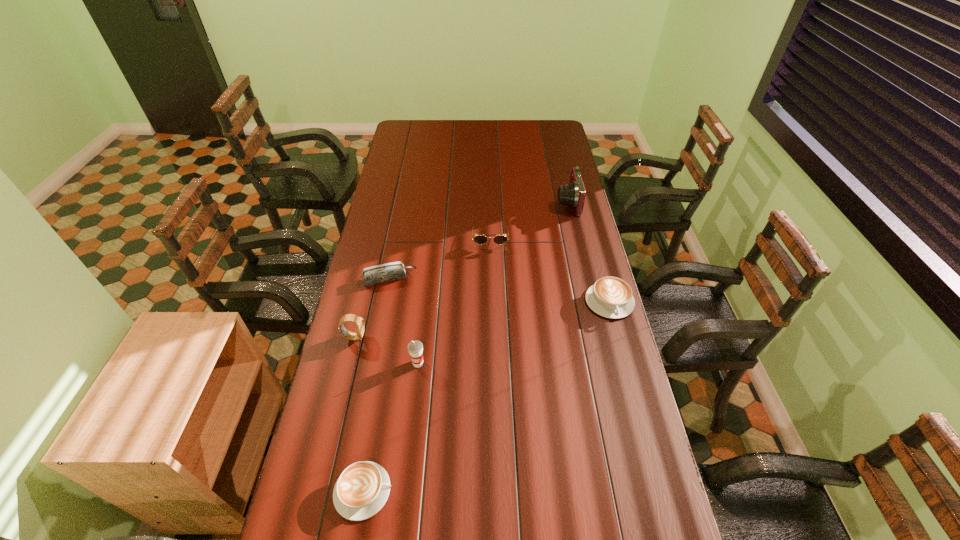
Where is `the fourth object from left to right`? the fourth object from left to right is located at coordinates (415, 347).

Find the location of a particular element. This screenshot has height=540, width=960. cup is located at coordinates (415, 347).

You are a GUI agent. You are given a task and a screenshot of the screen. Output one action in this format:
    pyautogui.click(x=<x>, y=<y>)
    Task: Click on the free location located on the side of the left cappuccino with the handle
    
    Given the screenshot: What is the action you would take?
    pyautogui.click(x=542, y=491)

Identify the location of blank area located on the side of the taller cappuccino with the handle. The image size is (960, 540). (641, 420).

At what (x,y) coordinates should I click in order to perform the action: click on vacant area situated on the front lenses of the sunglasses. Please return your answer as a coordinate pair (x, y). This screenshot has width=960, height=540. Looking at the image, I should click on (491, 268).

You are a GUI agent. You are given a task and a screenshot of the screen. Output one action in this format:
    pyautogui.click(x=<x>, y=<y>)
    Task: Click on the free region located 0.170m on the front of the pencil box
    This screenshot has width=960, height=540.
    Given the screenshot: What is the action you would take?
    pyautogui.click(x=380, y=324)

The height and width of the screenshot is (540, 960). What are the coordinates of `blank space located 0.060m on the face of the watch` in the screenshot? It's located at (383, 337).

Find the location of a particular element. vacant region located on the front-facing side of the camera is located at coordinates (511, 203).

You are a GUI agent. You are given a task and a screenshot of the screen. Output one action in this format:
    pyautogui.click(x=<x>, y=<y>)
    Task: Click on the free space located 0.070m on the front-facing side of the camera
    
    Given the screenshot: What is the action you would take?
    pyautogui.click(x=540, y=203)

Image resolution: width=960 pixels, height=540 pixels. Find the location of `vacant space located on the front-facing side of the camera`. vacant space located on the front-facing side of the camera is located at coordinates (516, 203).